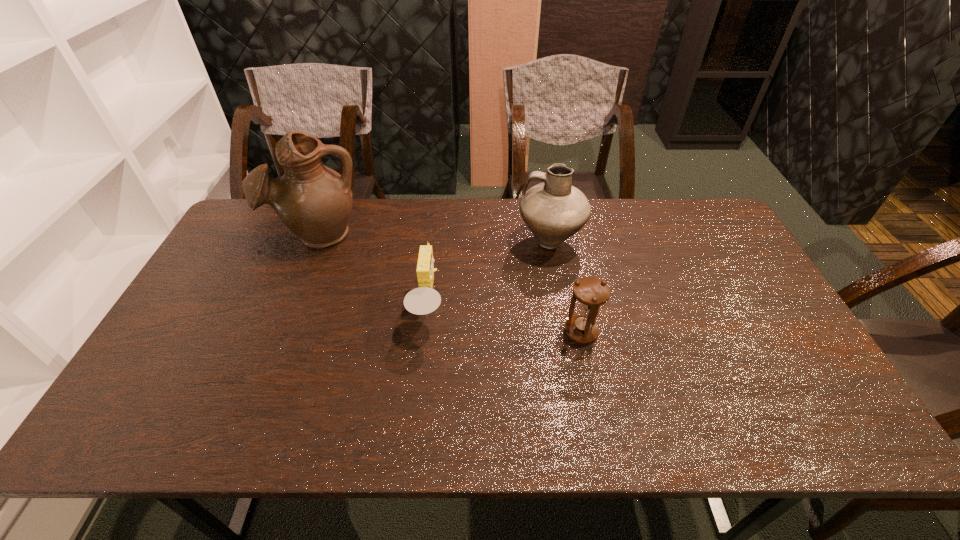
Find the location of `unoccupied area between the sponge and the hourglass`. unoccupied area between the sponge and the hourglass is located at coordinates (505, 320).

Locate an element on the screen. vacant area that lies between the taller pitcher and the hourglass is located at coordinates (449, 283).

At what (x,y) coordinates should I click in order to perform the action: click on vacant space that is in between the hourglass and the right pitcher. Please return your answer as a coordinate pair (x, y). This screenshot has height=540, width=960. Looking at the image, I should click on click(x=565, y=287).

You are a GUI agent. You are given a task and a screenshot of the screen. Output one action in this format:
    pyautogui.click(x=<x>, y=<y>)
    Task: Click on the vacant space in between the left pitcher and the third shortest object
    The height and width of the screenshot is (540, 960).
    Given the screenshot: What is the action you would take?
    pyautogui.click(x=434, y=238)

You are a GUI agent. You are given a task and a screenshot of the screen. Output one action in this format:
    pyautogui.click(x=<x>, y=<y>)
    Task: Click on the vacant region between the hourglass and the third shortest object
    This screenshot has height=540, width=960.
    Given the screenshot: What is the action you would take?
    pyautogui.click(x=565, y=287)

Locate an element on the screen. The height and width of the screenshot is (540, 960). empty space that is in between the sponge and the taller pitcher is located at coordinates (373, 271).

Where is `free space between the third object from right to left and the third shortest object`? This screenshot has height=540, width=960. free space between the third object from right to left and the third shortest object is located at coordinates (490, 274).

This screenshot has height=540, width=960. Identify the location of free space that is in between the right pitcher and the hourglass. (565, 287).

The width and height of the screenshot is (960, 540). Identify the location of free spot between the hourglass and the left pitcher. pos(449,283).

Identify the location of object that is the third closest to the shorter pitcher. The height and width of the screenshot is (540, 960). tap(313, 201).